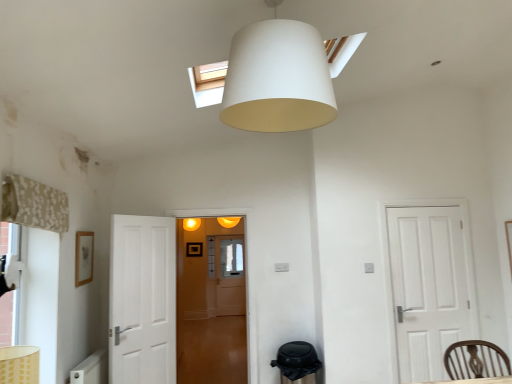
Question: Considering their positions, is beige floral fabric curtain at left located in front of or behind translucent wooden door at center?

Choices:
 (A) front
 (B) behind

Answer: (A)

Question: Do you think beige floral fabric curtain at left is within translucent wooden door at center, or outside of it?

Choices:
 (A) inside
 (B) outside

Answer: (B)

Question: Estimate the real-world distances between objects in this image. Which object is farther from the beige floral fabric curtain at left?

Choices:
 (A) white matte door at right
 (B) white matte lampshade at upper center
 (C) brown wooden chair at lower right
 (D) translucent wooden door at center

Answer: (A)

Question: Considering the real-world distances, which object is closest to the white matte lampshade at upper center?

Choices:
 (A) white matte door at right
 (B) beige floral fabric curtain at left
 (C) translucent wooden door at center
 (D) brown wooden chair at lower right

Answer: (B)